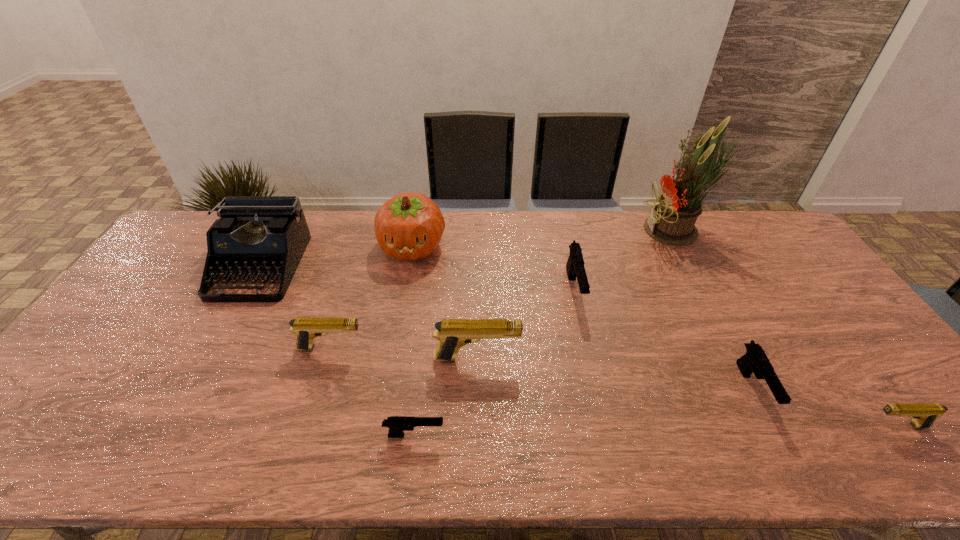
At what (x,y) coordinates should I click in order to perform the action: click on empty location between the fifth farthest object and the leftmost black pistol. Please return your answer as a coordinate pair (x, y). The height and width of the screenshot is (540, 960). Looking at the image, I should click on (372, 392).

Find the location of a particular element. Image resolution: width=960 pixels, height=540 pixels. vacant space that's between the nearest black pistol and the flower arrangement is located at coordinates (546, 333).

Where is `vacant area between the flower arrangement and the fifth pistol from left to right`? vacant area between the flower arrangement and the fifth pistol from left to right is located at coordinates (715, 310).

Find the location of `free spot between the second nearest tan pistol and the fifth pistol from left to right`. free spot between the second nearest tan pistol and the fifth pistol from left to right is located at coordinates coord(614,374).

Where is `free space between the leftmost object and the tallest object`? Image resolution: width=960 pixels, height=540 pixels. free space between the leftmost object and the tallest object is located at coordinates (468, 248).

At what (x,y) coordinates should I click in order to perform the action: click on free space between the second nearest object and the second tallest object. Please return your answer as a coordinate pair (x, y). Looking at the image, I should click on click(x=655, y=336).

Locate an element on the screen. The height and width of the screenshot is (540, 960). free space between the second farthest pistol and the second farthest tan pistol is located at coordinates [404, 353].

Locate an element on the screen. vacant area that lies between the pumpkin and the typewriter is located at coordinates (335, 256).

Choose which object is the third nearest neighbor to the sixth object from left to right. Please provide its 2D coordinates. Your answer should be formatted as a tuple, i.e. [(x, y)], where the tuple contains the x and y coordinates of a point satisfying the conditions above.

[(409, 226)]

Identify which object is the seventh closest to the flower arrangement. Please provide its 2D coordinates. Your answer should be formatted as a tuple, i.e. [(x, y)], where the tuple contains the x and y coordinates of a point satisfying the conditions above.

[(306, 329)]